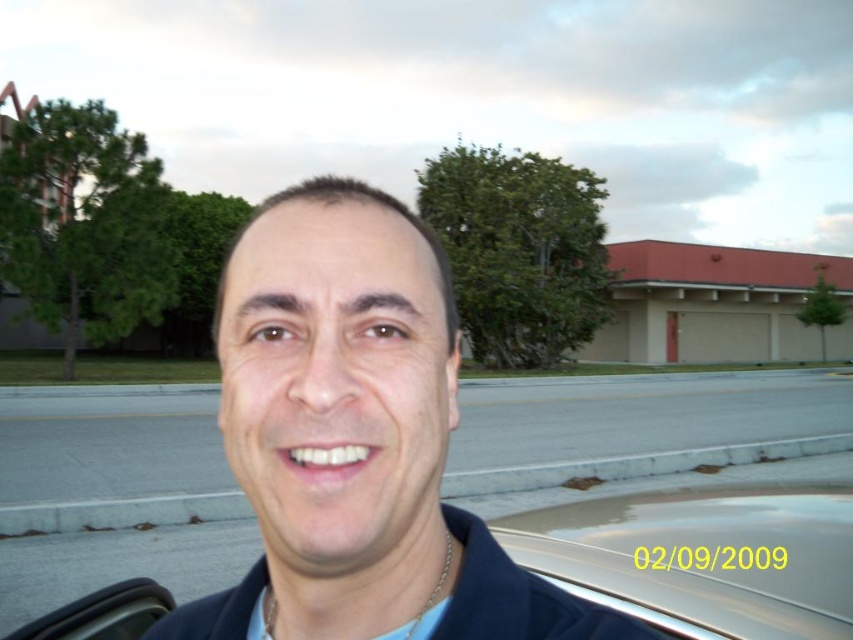
Is the position of blue fabric shirt at center less distant than that of clear glass car window at lower right?

Yes, blue fabric shirt at center is closer to the viewer.

Does blue fabric shirt at center have a lesser height compared to clear glass car window at lower right?

No, blue fabric shirt at center is not shorter than clear glass car window at lower right.

Is point (352, 356) positioned before point (532, 509)?

That is True.

This screenshot has height=640, width=853. What are the coordinates of `blue fabric shirt at center` in the screenshot? It's located at (357, 436).

Measure the distance from blue fabric shirt at center to blue cotton shirt at center.

blue fabric shirt at center is 8.34 inches from blue cotton shirt at center.

Is blue fabric shirt at center positioned in front of blue cotton shirt at center?

Yes, it is in front of blue cotton shirt at center.

The width and height of the screenshot is (853, 640). Describe the element at coordinates (357, 436) in the screenshot. I see `blue fabric shirt at center` at that location.

You are a GUI agent. You are given a task and a screenshot of the screen. Output one action in this format:
    pyautogui.click(x=<x>, y=<y>)
    Task: Click on the blue fabric shirt at center
    
    Given the screenshot: What is the action you would take?
    pyautogui.click(x=357, y=436)

Is blue fabric shirt at center thinner than gold metallic car at lower center?

Yes, blue fabric shirt at center is thinner than gold metallic car at lower center.

Identify the location of blue fabric shirt at center. This screenshot has width=853, height=640. (357, 436).

Is point (311, 611) positioned behind point (737, 616)?

That is False.

In order to click on blue fabric shirt at center in this screenshot , I will do `click(357, 436)`.